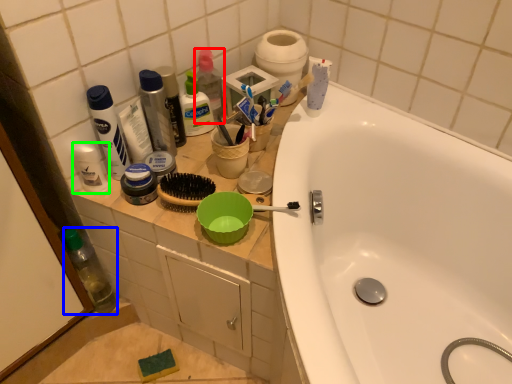
Question: Estimate the real-world distances between objects in this image. Which object is farther from toiletry (highlighted by a red box), bottle (highlighted by a blue box) or toiletry (highlighted by a green box)?

Choices:
 (A) bottle
 (B) toiletry

Answer: (A)